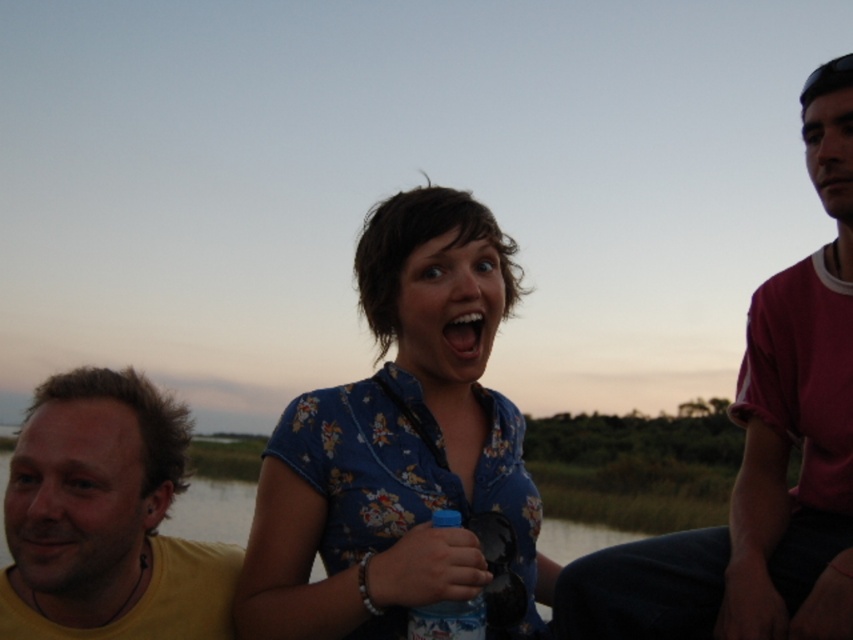
Question: Is floral cotton shirt at center behind yellow matte shirt at left?

Choices:
 (A) yes
 (B) no

Answer: (A)

Question: Which object is farther from the camera taking this photo?

Choices:
 (A) matte pink shirt at right
 (B) yellow matte shirt at left
 (C) blue plastic bottle at center

Answer: (A)

Question: Which object appears farthest from the camera in this image?

Choices:
 (A) floral cotton shirt at center
 (B) blue plastic bottle at center
 (C) matte pink shirt at right
 (D) yellow matte shirt at left

Answer: (A)

Question: Is matte pink shirt at right positioned behind blue plastic bottle at center?

Choices:
 (A) no
 (B) yes

Answer: (B)

Question: Which point is farther to the camera?

Choices:
 (A) blue plastic bottle at center
 (B) yellow matte shirt at left
 (C) matte pink shirt at right

Answer: (C)

Question: Can you confirm if yellow matte shirt at left is positioned above blue plastic bottle at center?

Choices:
 (A) yes
 (B) no

Answer: (A)